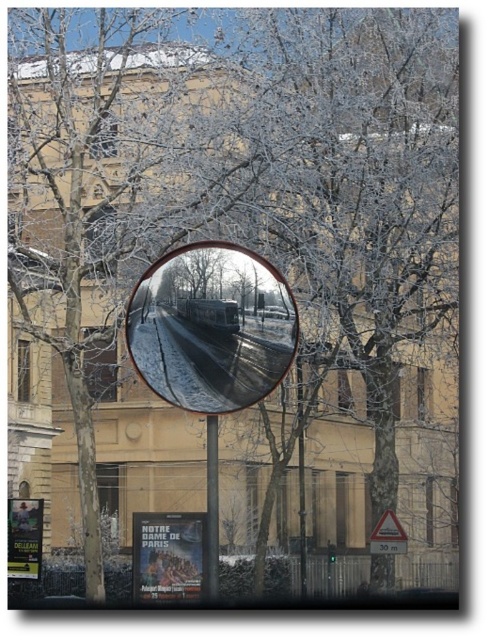
You are a delivery person trying to determine if your 1.5 meter wide package can fit through the space between the clear glass mirror at center and the metallic pole at center. Based on the scene, can the package pass through?

The clear glass mirror at center is wider than the metallic pole at center. However, the description only states their relative widths, not the distance between them. Without knowing the exact spacing between the two objects, it is impossible to determine if the 1.5 meter wide package can fit through the space between them.

You are a delivery driver approaching a snowy street. You notice a clear glass mirror at center and a yellow plastic triangle at lower right in your view. Which object is closer to the left side of your field of view?

The clear glass mirror at center is closer to the left side of your field of view because it is positioned to the left of the yellow plastic triangle at lower right.